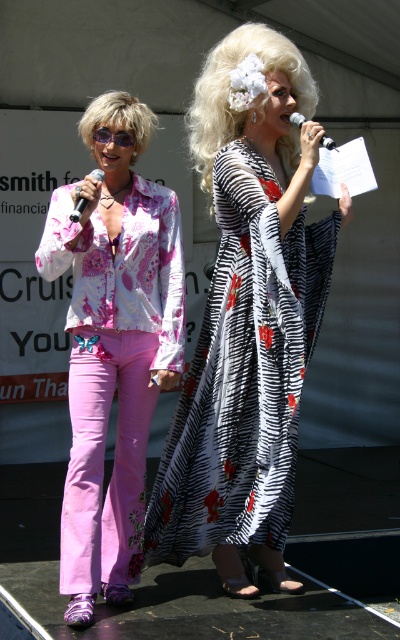
In the scene shown: You are a photographer positioned in front of the stage. You need to capture a clear photo of both the blonde synthetic wig at upper center and the matte black microphone at left. Which object should you focus on first to ensure it appears sharp in the photo?

The blonde synthetic wig at upper center is closer to you than the matte black microphone at left, so you should focus on the blonde synthetic wig at upper center first to ensure it appears sharp in the photo.

You are a stagehand preparing to set up equipment. You need to place the purple plastic goggles at left and the metallic silver microphone at upper center on a shelf. If the shelf can only hold items smaller than the microphone, will both items fit?

The purple plastic goggles at left has a smaller size compared to metallic silver microphone at upper center, so the goggles will fit on the shelf, but the microphone may not. Therefore, only the purple plastic goggles at left can be placed there.

You are a photographer at the event and need to place a spotlight at the point specified in the image. The spotlight must be placed on the blonde synthetic wig at upper center. Is the point at coordinates point (231,88) on the blonde synthetic wig at upper center?

Yes, the point (231,88) is on the blonde synthetic wig at upper center according to the description.